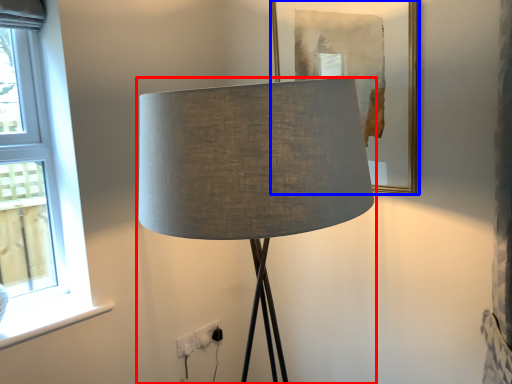
Question: Among these objects, which one is nearest to the camera, lamp (highlighted by a red box) or picture frame (highlighted by a blue box)?

Choices:
 (A) lamp
 (B) picture frame

Answer: (A)